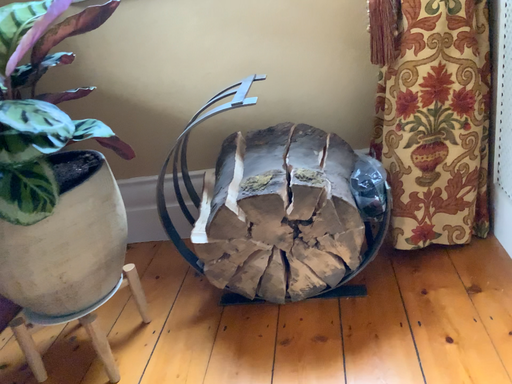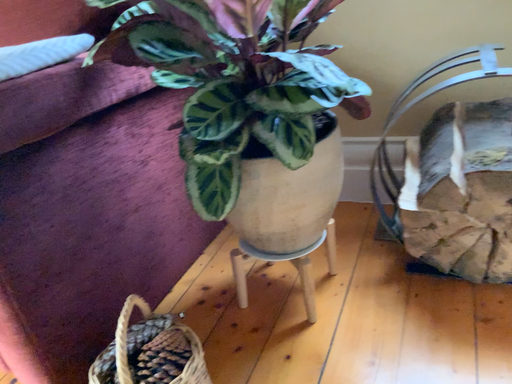
Question: Which way did the camera rotate in the video?

Choices:
 (A) rotated right
 (B) rotated left

Answer: (B)